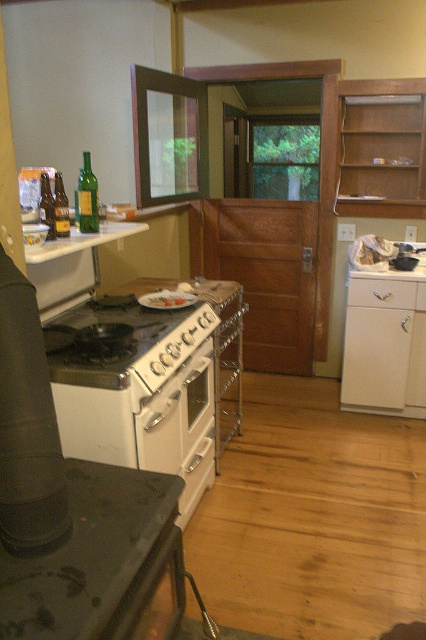
You are arranging dishes in the kitchen and have two plates in front of you. You want to place them side by side on a shelf that can only accommodate items spaced 0.5 inches apart. Can both the white matte plate at center and the white glossy plate at center fit on the shelf without overlapping?

The white matte plate at center is 0.36 inches away from the white glossy plate at center, so yes, they can fit on the shelf since the required spacing is less than the shelf capacity of 0.5 inches.

You are trying to determine which object is taller between the white glossy gas stove at center and the white matte plate at center in the kitchen. Based on the scene description, which one is taller?

The white glossy gas stove at center is taller than the white matte plate at center according to the description.